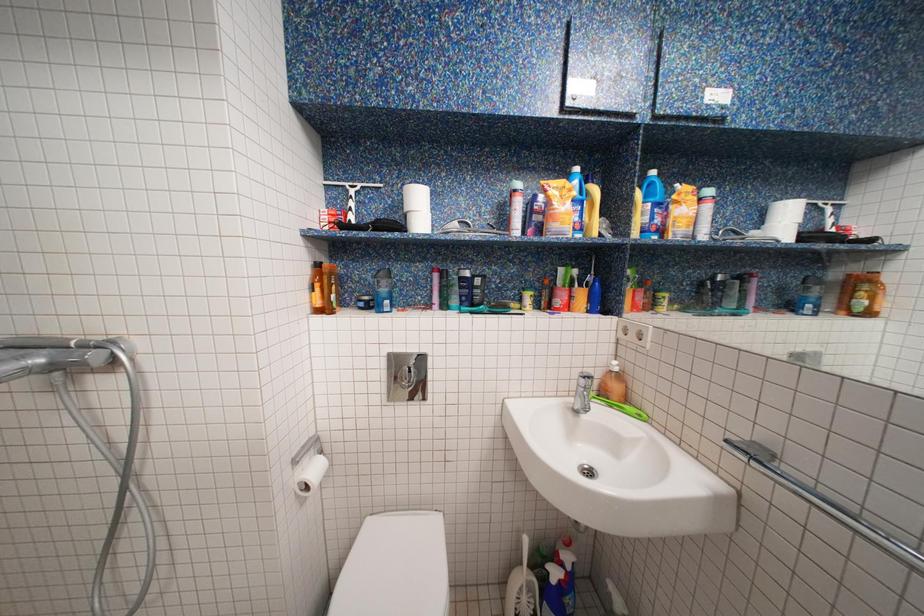
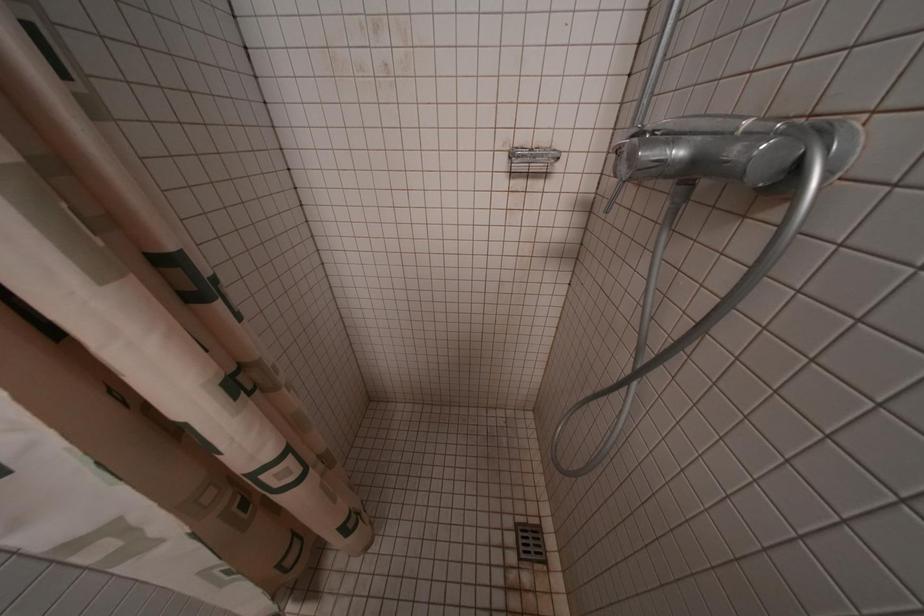
The first image is from the beginning of the video and the second image is from the end. How did the camera likely rotate when shooting the video?

The rotation direction of the camera is left-down.